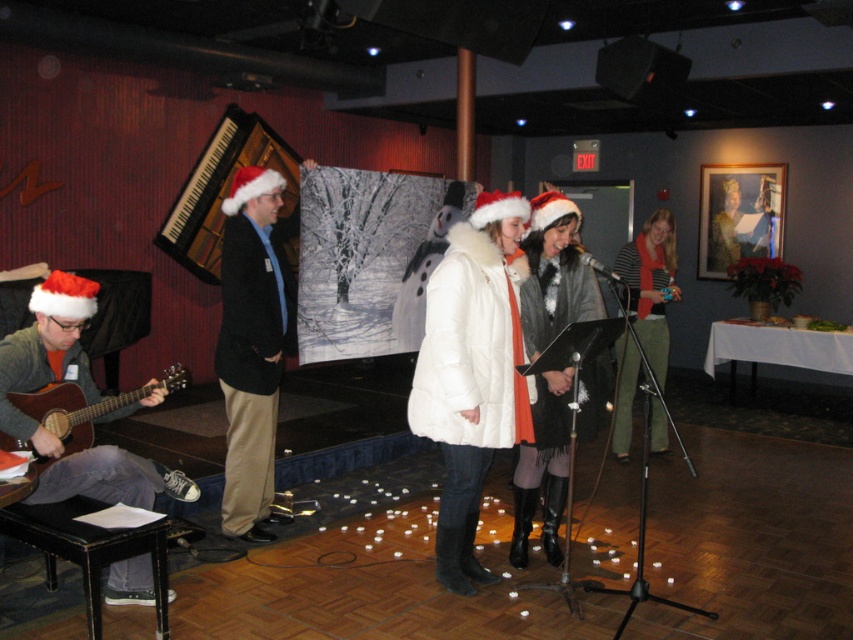
You are at the holiday event and need to determine which object is taller between the black woolen jacket at center and the matte brown acoustic guitar at lower left. Based on the scene description, which one is taller?

The black woolen jacket at center is taller than the matte brown acoustic guitar at lower left.

You are standing at the entrance of the room and want to take a photo that includes both the point at (24,353) and the point at (514,560). Which point should you focus on first to ensure both are in focus?

You should focus on the point at (514,560) first because it is farther from the camera than the point at (24,353), ensuring both will be in focus when using depth of field.

You are organizing a winter photoshoot and need to decide which coat to use for a closeup shot. The camera lens can only accommodate items up to 10 cm in thickness. Given the black woolen jacket at center and the white fur coat at center, which one is more likely to fit within the camera lens constraints?

The black woolen jacket at center is thinner than the white fur coat at center, so it is more likely to fit within the camera lens constraints of up to 10 cm in thickness.